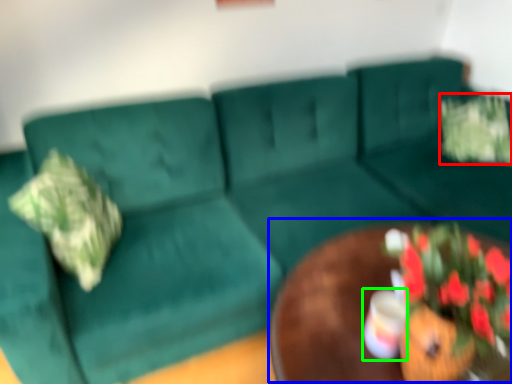
Question: Which object is positioned closest to flower (highlighted by a red box)? Select from round table (highlighted by a blue box) and coffee cup (highlighted by a green box).

Choices:
 (A) round table
 (B) coffee cup

Answer: (A)